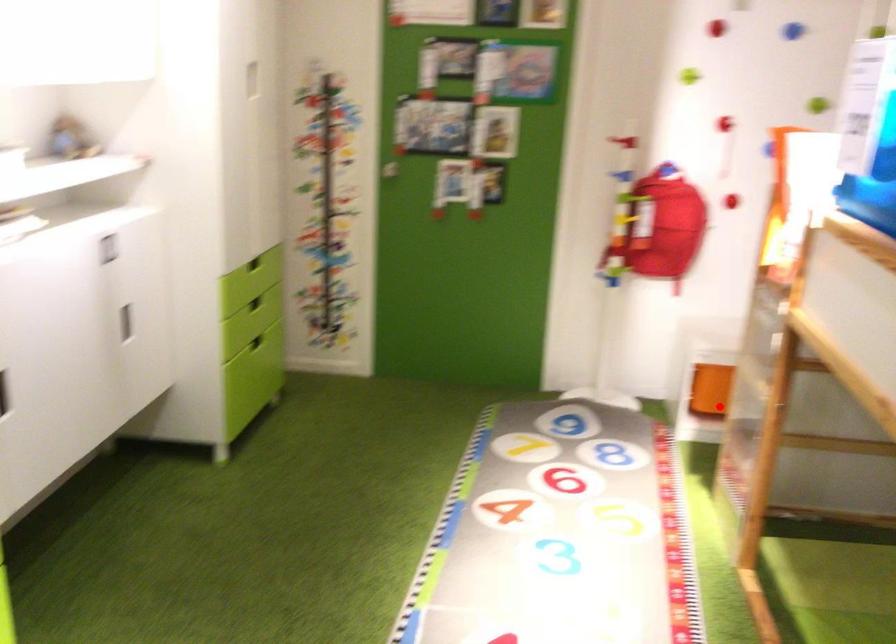
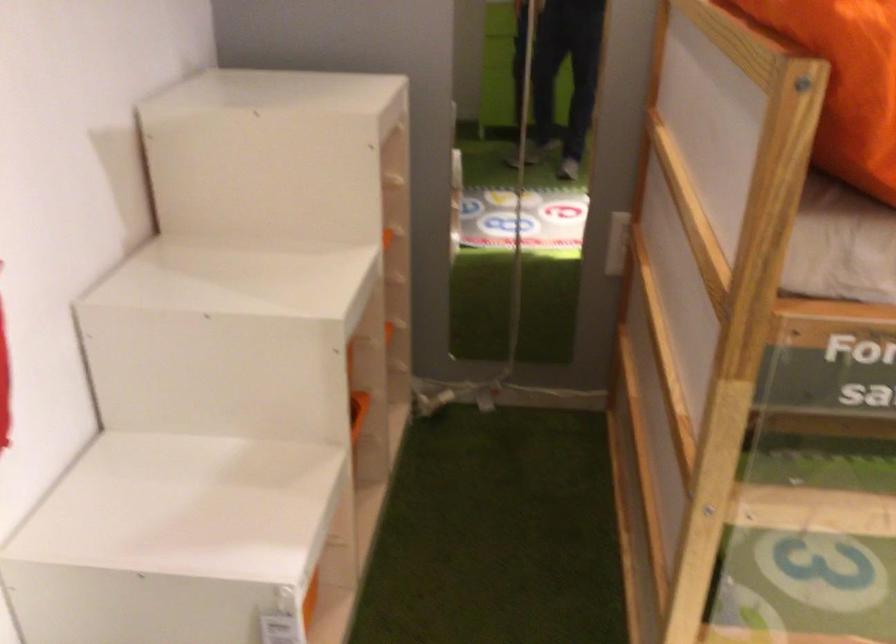
Question: I am providing you with two images of the same scene from different viewpoints. Given a red point in image1, look at the same physical point in image2. Is it:

Choices:
 (A) Closer to the viewpoint
 (B) Farther from the viewpoint

Answer: (A)